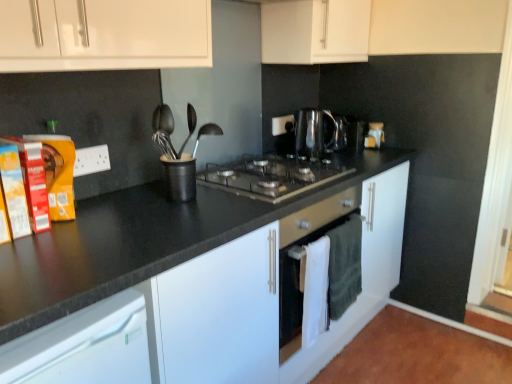
Image resolution: width=512 pixels, height=384 pixels. In order to click on vacant space that is to the left of black matte utensil holder at center in this screenshot , I will do `click(125, 197)`.